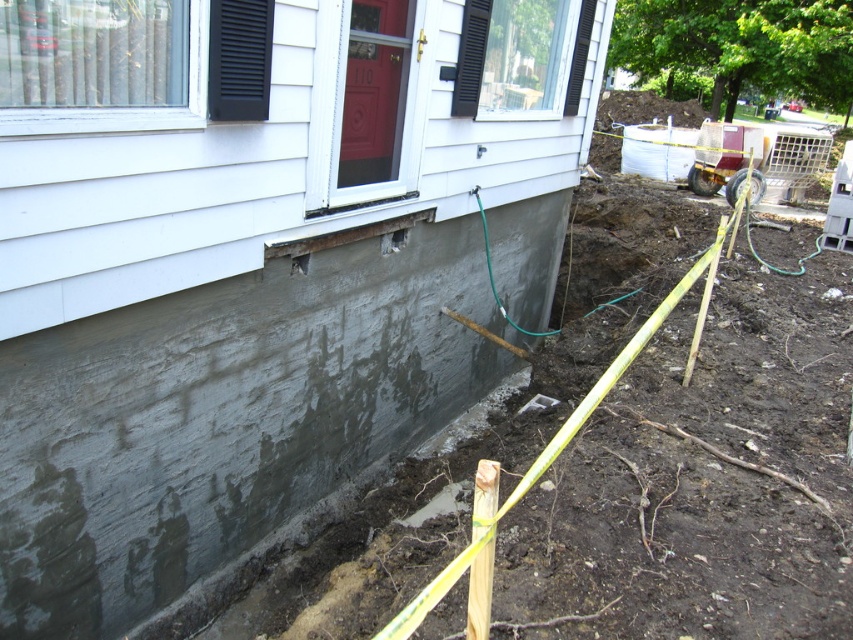
You are standing at the edge of the trench and want to place a safety sign at the point that is closer to you. Which point should you choose between point (143,564) and point (293,266)?

Point (143,564) is closer to the camera than point (293,266), so you should place the safety sign at point (143,564).

In the scene shown: You are a construction worker standing at the trench edge. You see the gray concrete foundation at lower left and the rusty metal hole at lower center. Which object is closer to you?

The gray concrete foundation at lower left is closer to you because it is in front of the rusty metal hole at lower center.

You are a construction worker needing to place a 2x4 wooden board between the gray concrete foundation at lower left and the rusty metal hole at lower center. Can the board fit horizontally between them without bending?

The gray concrete foundation at lower left might be wider than rusty metal hole at lower center, so the 2x4 board could fit horizontally between them if the distance between them is sufficient. However, the exact width difference isn not specified, so caution is advised.